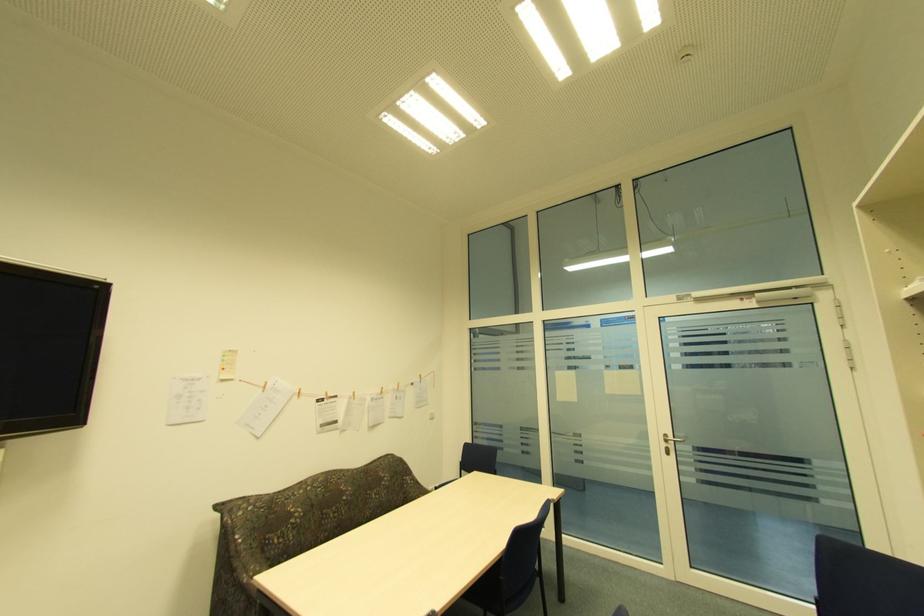
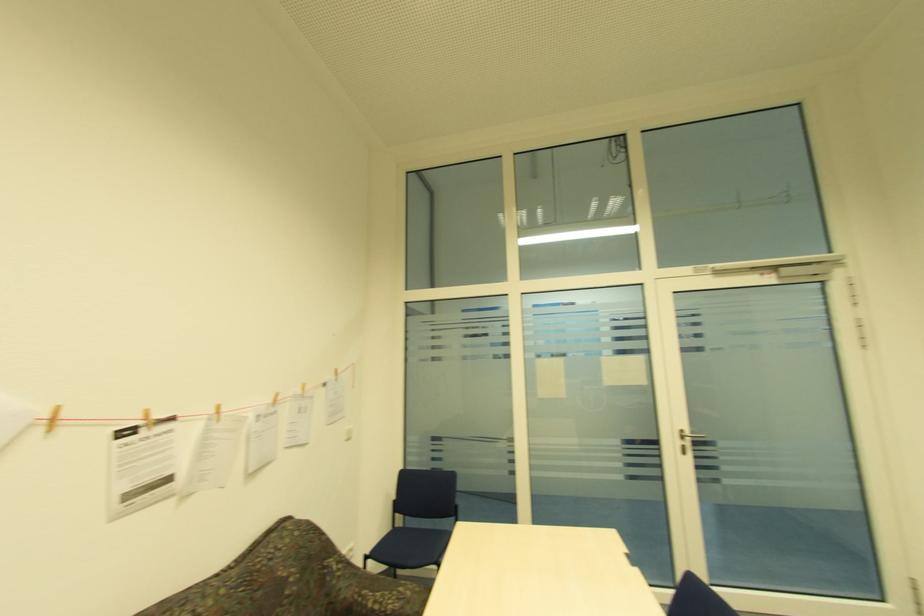
Locate, in the second image, the point that corresponds to (x=327, y=394) in the first image.

(141, 416)